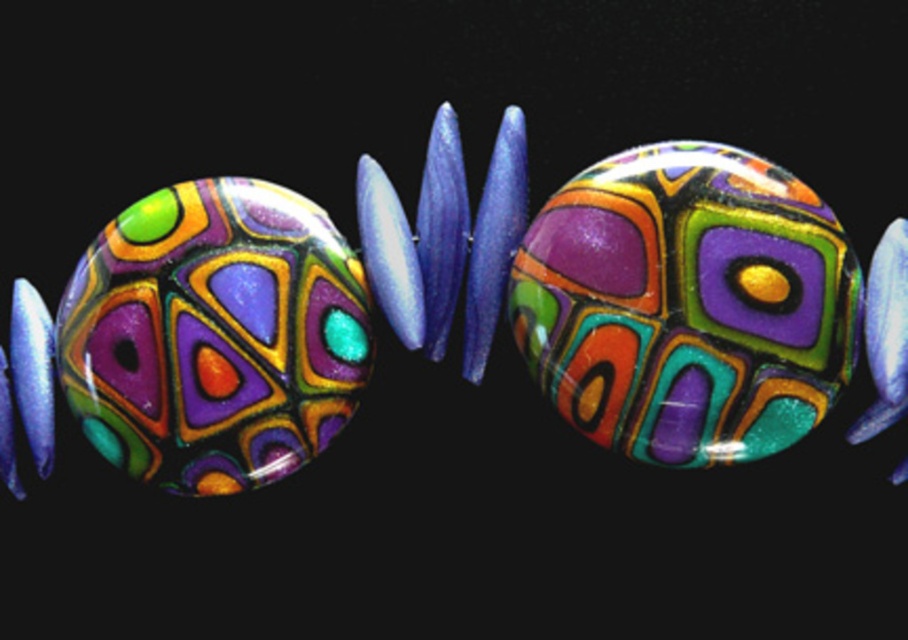
You are an artisan creating a necklace and need to place the glossy glass bead at center and the glossy glass bead at left in a specific arrangement. Which bead should you place first if you want the taller bead to be positioned above the shorter one?

You should place the glossy glass bead at center first since it is taller than the glossy glass bead at left, allowing it to be positioned above the shorter bead.

You are an artisan trying to place the glossy glass bead at center and the glossy glass bead at left into a necklace design. Which bead should you choose if you want the one that occupies more horizontal space?

The glossy glass bead at center might be wider than glossy glass bead at left, so you should choose the glossy glass bead at center if you want the one that occupies more horizontal space.

You are an artist arranging beads for a necklace. You have two glossy glass beads, one at the center and one at the left. You want to ensure the bead at the center is visible. Should you place the glossy glass bead at center in front of or behind the glossy glass bead at left?

The glossy glass bead at center is already in front of the glossy glass bead at left, so to keep it visible, you should place the glossy glass bead at center in front of the glossy glass bead at left.